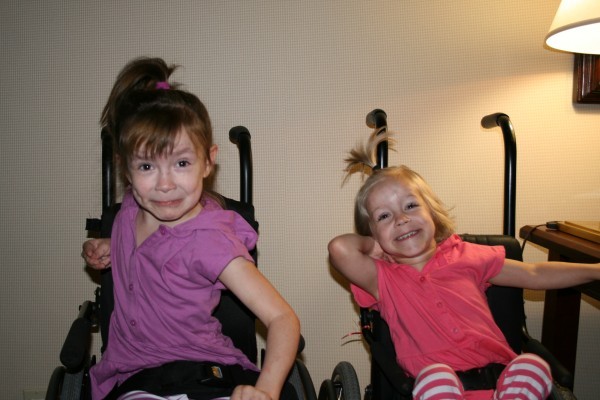
The height and width of the screenshot is (400, 600). Identify the location of lamp shade. (571, 17).